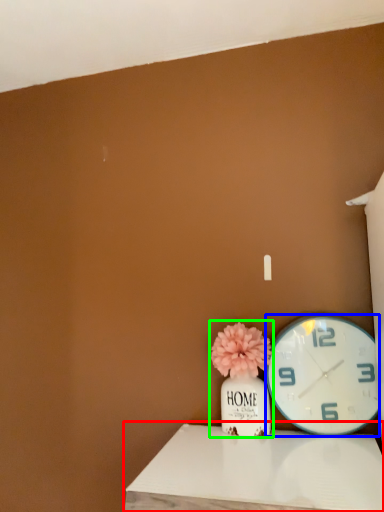
Question: Which is farther away from table (highlighted by a red box)? wall clock (highlighted by a blue box) or floral arrangement (highlighted by a green box)?

Choices:
 (A) wall clock
 (B) floral arrangement

Answer: (A)